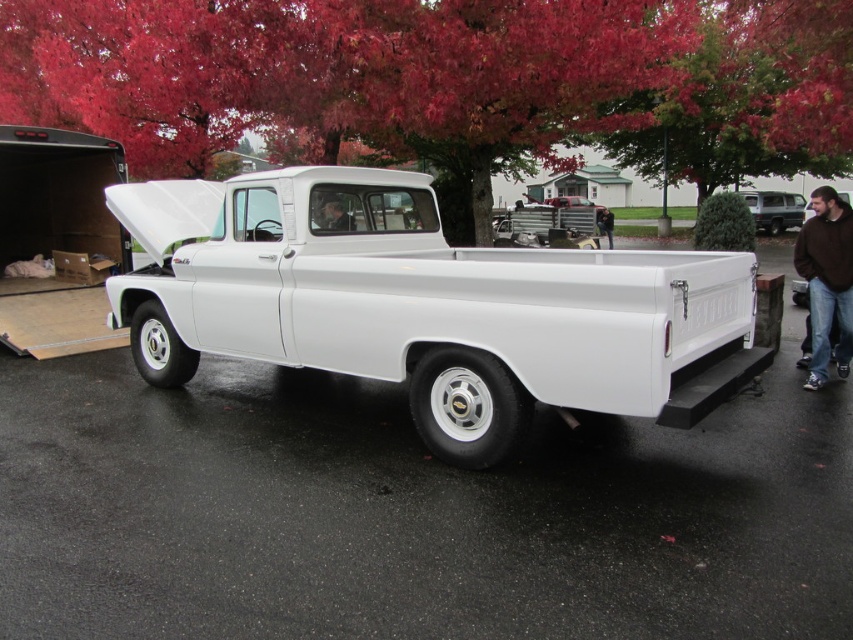
Question: Can you confirm if reddish-brown bark tree at upper center is smaller than matte black shirt at center?

Choices:
 (A) no
 (B) yes

Answer: (A)

Question: In this image, where is reddish-brown bark tree at upper center located relative to white glossy pickup truck at center?

Choices:
 (A) below
 (B) above

Answer: (B)

Question: Can you confirm if white glossy pickup truck at center is smaller than matte black shirt at center?

Choices:
 (A) yes
 (B) no

Answer: (B)

Question: Which point is farther from the camera taking this photo?

Choices:
 (A) (347, 225)
 (B) (248, 266)
 (C) (119, 104)
 (D) (846, 225)

Answer: (C)

Question: Among these objects, which one is nearest to the camera?

Choices:
 (A) white glossy pickup truck at center
 (B) reddish-brown bark tree at upper center
 (C) matte black shirt at center
 (D) brown fuzzy sweater at right

Answer: (A)

Question: Among these points, which one is nearest to the camera?

Choices:
 (A) (822, 324)
 (B) (683, 380)
 (C) (343, 209)

Answer: (B)